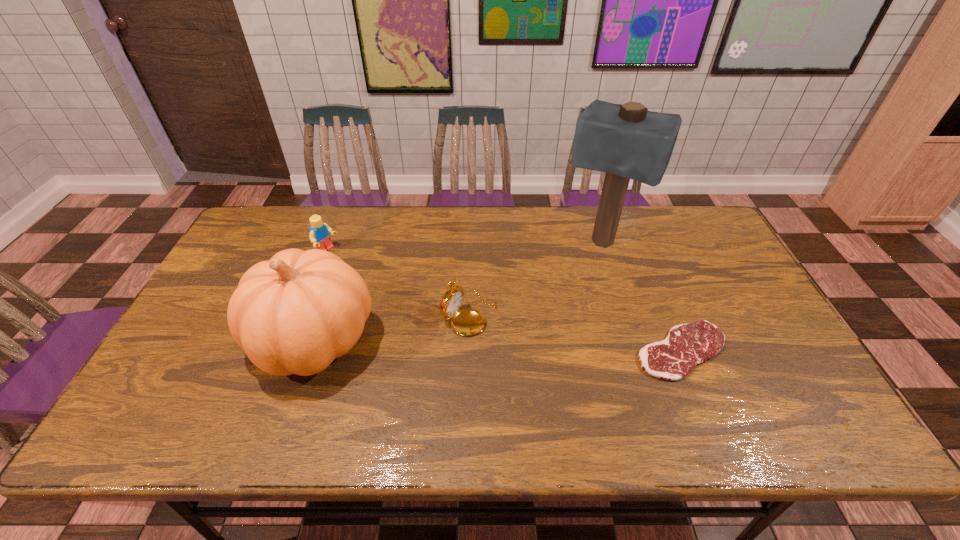
Where is `object that is at the right edge`? The image size is (960, 540). object that is at the right edge is located at coordinates (686, 345).

Locate an element on the screen. This screenshot has width=960, height=540. object that is at the near right corner is located at coordinates (686, 345).

Identify the location of free space at the far edge. (441, 214).

In the image, there is a desktop. Identify the location of vacant space at the near edge. The width and height of the screenshot is (960, 540). (530, 382).

The image size is (960, 540). Find the location of `blank space at the left edge of the desktop`. blank space at the left edge of the desktop is located at coordinates (203, 359).

This screenshot has width=960, height=540. Find the location of `vacant area at the right edge`. vacant area at the right edge is located at coordinates (693, 266).

Find the location of a particular element. The image size is (960, 540). vacant point at the far left corner is located at coordinates (292, 221).

Where is `free region at the far right corner`? This screenshot has height=540, width=960. free region at the far right corner is located at coordinates (657, 210).

At what (x,y) coordinates should I click in order to perform the action: click on free space between the shortest object and the second tallest object. Please return your answer as a coordinate pair (x, y). The height and width of the screenshot is (540, 960). Looking at the image, I should click on pyautogui.click(x=498, y=346).

Image resolution: width=960 pixels, height=540 pixels. Identify the location of vacant point located between the pumpkin and the shortest object. (498, 346).